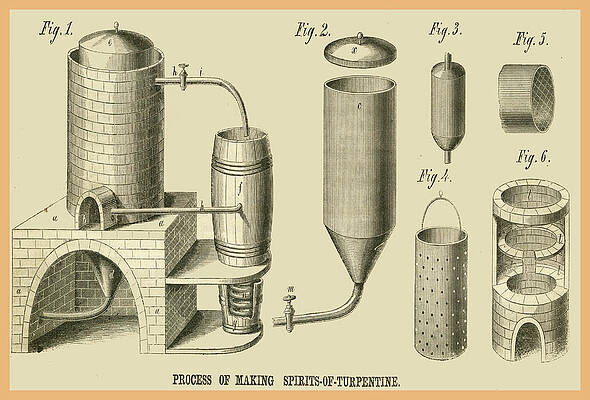
The height and width of the screenshot is (400, 590). What are the coordinates of `wooden container` in the screenshot? It's located at (255, 193).